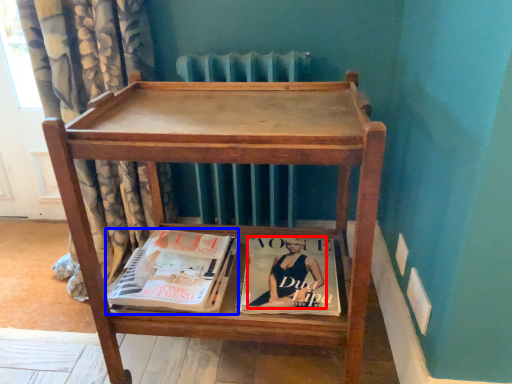
Question: Which object is closer to the camera taking this photo, person (highlighted by a red box) or book (highlighted by a blue box)?

Choices:
 (A) person
 (B) book

Answer: (B)